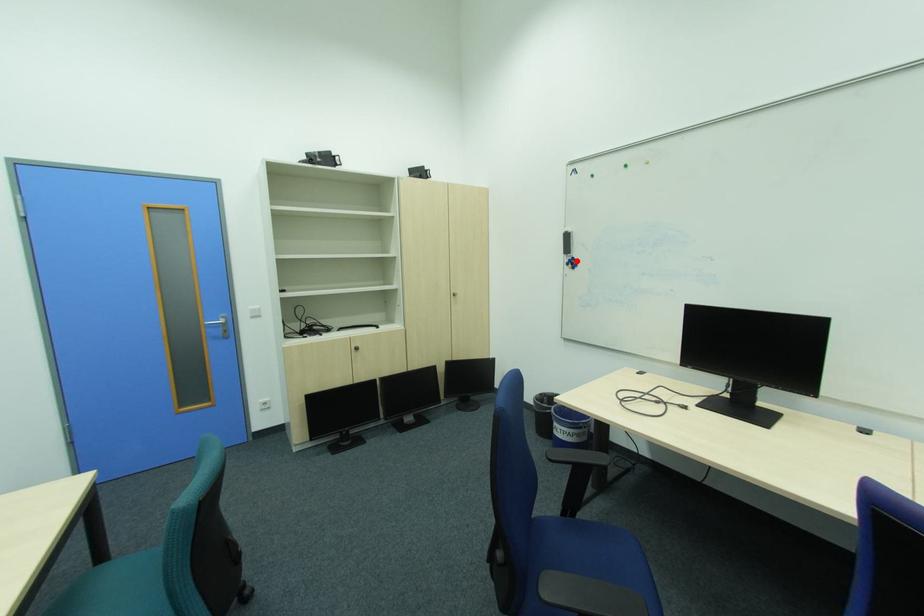
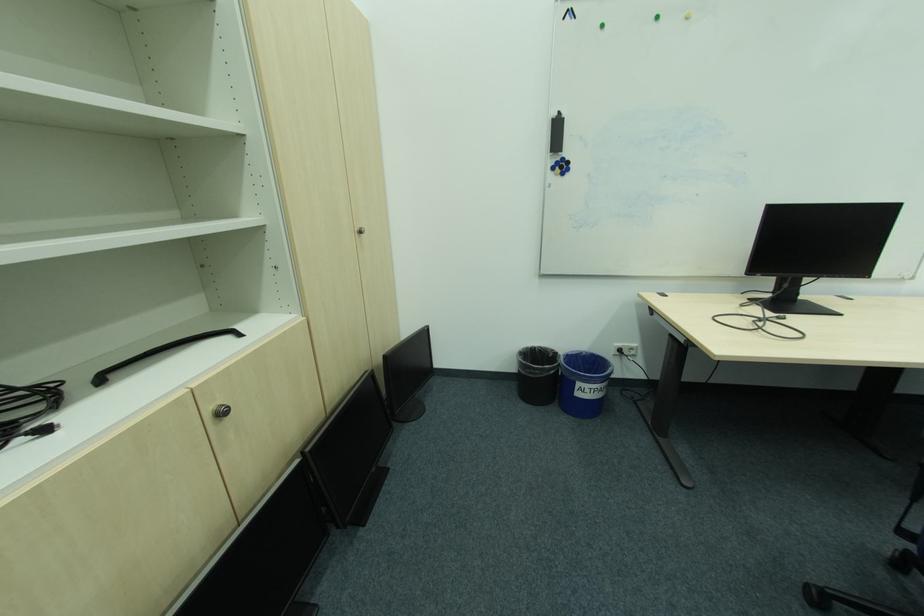
Find the pixel in the second image that matches the highlighted location in the first image.

(565, 163)